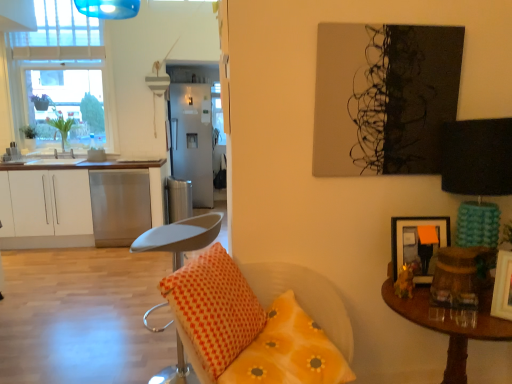
Question: Can you confirm if satin silver trash can at center is taller than wooden picture frame at right, the second picture frame positioned from the back?

Choices:
 (A) no
 (B) yes

Answer: (B)

Question: Considering the relative positions of satin silver trash can at center and wooden picture frame at right, positioned as the 2th picture frame in left-to-right order, in the image provided, is satin silver trash can at center to the left of wooden picture frame at right, positioned as the 2th picture frame in left-to-right order, from the viewer's perspective?

Choices:
 (A) yes
 (B) no

Answer: (A)

Question: Is satin silver trash can at center further to the viewer compared to wooden picture frame at right, which is the 1th picture frame in right-to-left order?

Choices:
 (A) yes
 (B) no

Answer: (A)

Question: Considering the relative sizes of satin silver trash can at center and wooden picture frame at right, which is the 1th picture frame in right-to-left order, in the image provided, is satin silver trash can at center shorter than wooden picture frame at right, which is the 1th picture frame in right-to-left order,?

Choices:
 (A) no
 (B) yes

Answer: (A)

Question: From a real-world perspective, is satin silver trash can at center below wooden picture frame at right, positioned as the 2th picture frame in left-to-right order?

Choices:
 (A) yes
 (B) no

Answer: (A)

Question: Based on their positions, is white matte cabinet at left located to the left or right of satin silver refrigerator at center?

Choices:
 (A) left
 (B) right

Answer: (A)

Question: Relative to satin silver refrigerator at center, is white matte cabinet at left in front or behind?

Choices:
 (A) behind
 (B) front

Answer: (B)

Question: From their relative heights in the image, would you say white matte cabinet at left is taller or shorter than satin silver refrigerator at center?

Choices:
 (A) short
 (B) tall

Answer: (A)

Question: Looking at their shapes, would you say white matte cabinet at left is wider or thinner than satin silver refrigerator at center?

Choices:
 (A) thin
 (B) wide

Answer: (A)

Question: In terms of width, does orange dotted pillow at lower center, the first pillow when ordered from right to left, look wider or thinner when compared to wooden picture frame at right, positioned as the 2th picture frame in left-to-right order?

Choices:
 (A) wide
 (B) thin

Answer: (A)

Question: From a real-world perspective, is orange dotted pillow at lower center, which is the second pillow from left to right, positioned above or below wooden picture frame at right, the 1th picture frame viewed from the front?

Choices:
 (A) above
 (B) below

Answer: (B)

Question: Considering the positions of orange dotted pillow at lower center, the first pillow when ordered from right to left, and wooden picture frame at right, positioned as the 2th picture frame in left-to-right order, in the image, is orange dotted pillow at lower center, the first pillow when ordered from right to left, taller or shorter than wooden picture frame at right, positioned as the 2th picture frame in left-to-right order,?

Choices:
 (A) short
 (B) tall

Answer: (B)

Question: Considering their positions, is orange dotted pillow at lower center, the first pillow when ordered from right to left, located in front of or behind wooden picture frame at right, the second picture frame positioned from the back?

Choices:
 (A) front
 (B) behind

Answer: (A)

Question: Considering the positions of orange dotted pillow at lower center, the first pillow when ordered from right to left, and brown wooden table at right in the image, is orange dotted pillow at lower center, the first pillow when ordered from right to left, bigger or smaller than brown wooden table at right?

Choices:
 (A) small
 (B) big

Answer: (A)

Question: Looking at their shapes, would you say orange dotted pillow at lower center, the first pillow when ordered from right to left, is wider or thinner than brown wooden table at right?

Choices:
 (A) wide
 (B) thin

Answer: (B)